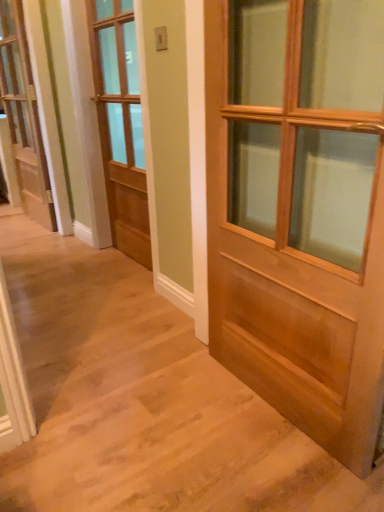
Question: Would you say light brown wooden door at center, the 1th door in the right-to-left sequence, is part of white painted wood door at left, positioned as the 3th door in right-to-left order,'s contents?

Choices:
 (A) yes
 (B) no

Answer: (B)

Question: From the image's perspective, is white painted wood door at left, positioned as the 3th door in right-to-left order, under light brown wooden door at center, the 1th door in the right-to-left sequence?

Choices:
 (A) yes
 (B) no

Answer: (B)

Question: Considering the relative sizes of white painted wood door at left, the 1th door from the left, and light brown wooden door at center, placed as the first door when sorted from front to back, in the image provided, is white painted wood door at left, the 1th door from the left, bigger than light brown wooden door at center, placed as the first door when sorted from front to back,?

Choices:
 (A) no
 (B) yes

Answer: (A)

Question: From a real-world perspective, does white painted wood door at left, marked as the 1th door in a back-to-front arrangement, stand above light brown wooden door at center, placed as the first door when sorted from front to back?

Choices:
 (A) no
 (B) yes

Answer: (B)

Question: Is white painted wood door at left, the 1th door from the left, positioned with its back to light brown wooden door at center, placed as the third door when sorted from left to right?

Choices:
 (A) yes
 (B) no

Answer: (B)

Question: Considering their positions, is light brown wood door at center, acting as the 2th door starting from the back, located in front of or behind light brown wooden door at center, placed as the third door when sorted from left to right?

Choices:
 (A) behind
 (B) front

Answer: (A)

Question: Looking at the image, does light brown wood door at center, acting as the 2th door starting from the back, seem bigger or smaller compared to light brown wooden door at center, the 1th door in the right-to-left sequence?

Choices:
 (A) small
 (B) big

Answer: (A)

Question: Is light brown wood door at center, acting as the 2th door starting from the right, inside the boundaries of light brown wooden door at center, placed as the first door when sorted from front to back, or outside?

Choices:
 (A) outside
 (B) inside

Answer: (A)

Question: Does point (135, 123) appear closer or farther from the camera than point (266, 372)?

Choices:
 (A) farther
 (B) closer

Answer: (A)

Question: Considering the positions of white painted wood door at left, positioned as the 3th door in right-to-left order, and light brown wood door at center, acting as the 2th door starting from the back, in the image, is white painted wood door at left, positioned as the 3th door in right-to-left order, wider or thinner than light brown wood door at center, acting as the 2th door starting from the back,?

Choices:
 (A) wide
 (B) thin

Answer: (B)

Question: From a real-world perspective, relative to light brown wood door at center, acting as the 2th door starting from the back, is white painted wood door at left, marked as the 1th door in a back-to-front arrangement, vertically above or below?

Choices:
 (A) above
 (B) below

Answer: (A)

Question: Considering the positions of white painted wood door at left, positioned as the 3th door in right-to-left order, and light brown wood door at center, the 2th door from the left, in the image, is white painted wood door at left, positioned as the 3th door in right-to-left order, taller or shorter than light brown wood door at center, the 2th door from the left,?

Choices:
 (A) short
 (B) tall

Answer: (B)

Question: Is white painted wood door at left, positioned as the 3th door in right-to-left order, inside or outside of light brown wood door at center, the 2th door from the left?

Choices:
 (A) inside
 (B) outside

Answer: (B)

Question: Visually, is light brown wooden door at center, marked as the third door in a back-to-front arrangement, positioned to the left or to the right of white painted wood door at left, placed as the third door when sorted from front to back?

Choices:
 (A) left
 (B) right

Answer: (B)

Question: Looking at their shapes, would you say light brown wooden door at center, the 1th door in the right-to-left sequence, is wider or thinner than white painted wood door at left, placed as the third door when sorted from front to back?

Choices:
 (A) thin
 (B) wide

Answer: (B)